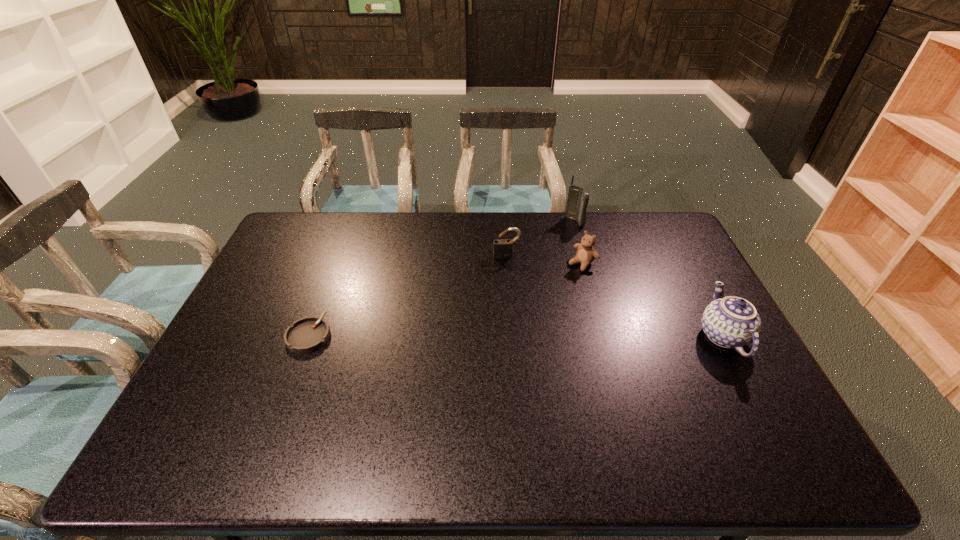
At what (x,y) coordinates should I click in order to perform the action: click on vacant area that lies between the fourth object from right to left and the teddy bear. Please return your answer as a coordinate pair (x, y). Looking at the image, I should click on (544, 260).

Find the location of a particular element. The image size is (960, 540). vacant area that lies between the padlock and the teddy bear is located at coordinates (544, 260).

Find the location of a particular element. The width and height of the screenshot is (960, 540). blank region between the leftmost object and the teddy bear is located at coordinates (445, 299).

Where is `free space between the tallest object and the leftmost object`? This screenshot has height=540, width=960. free space between the tallest object and the leftmost object is located at coordinates (442, 279).

Image resolution: width=960 pixels, height=540 pixels. In order to click on vacant region between the teddy bear and the fourth shortest object in this screenshot , I will do `click(653, 300)`.

Where is `unoccupied area between the farthest object and the ashtray`? Image resolution: width=960 pixels, height=540 pixels. unoccupied area between the farthest object and the ashtray is located at coordinates (442, 279).

This screenshot has height=540, width=960. I want to click on free area in between the farthest object and the ashtray, so click(x=442, y=279).

Locate which object ranks in proximity to the leftmost object. Please provide its 2D coordinates. Your answer should be formatted as a tuple, i.e. [(x, y)], where the tuple contains the x and y coordinates of a point satisfying the conditions above.

[(502, 248)]

Identify which object is the second nearest to the farthest object. Please provide its 2D coordinates. Your answer should be formatted as a tuple, i.e. [(x, y)], where the tuple contains the x and y coordinates of a point satisfying the conditions above.

[(502, 248)]

Identify the location of vacant space that satisfies the following two spatial constraints: 1. on the front side of the fourth object from right to left; 2. on the left side of the teddy bear. (507, 264).